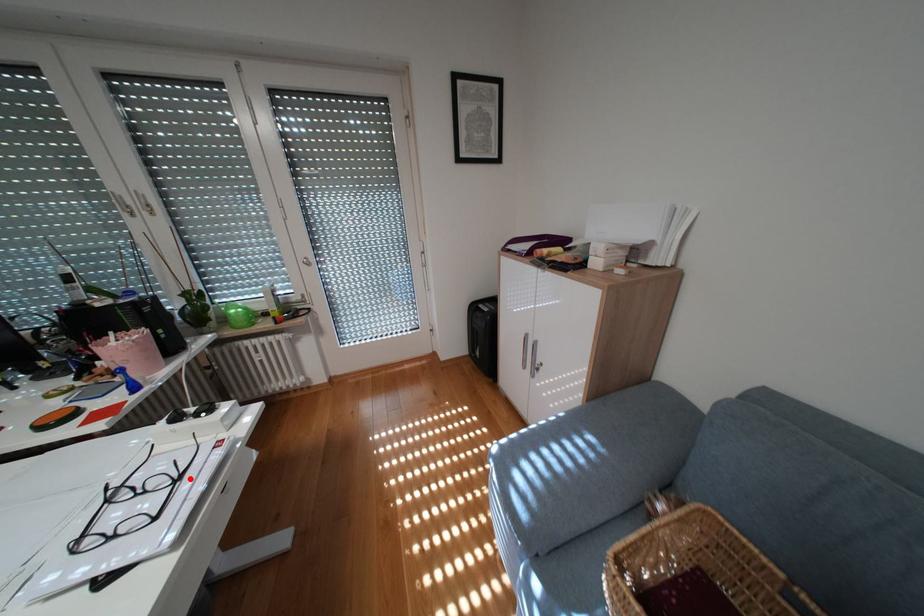
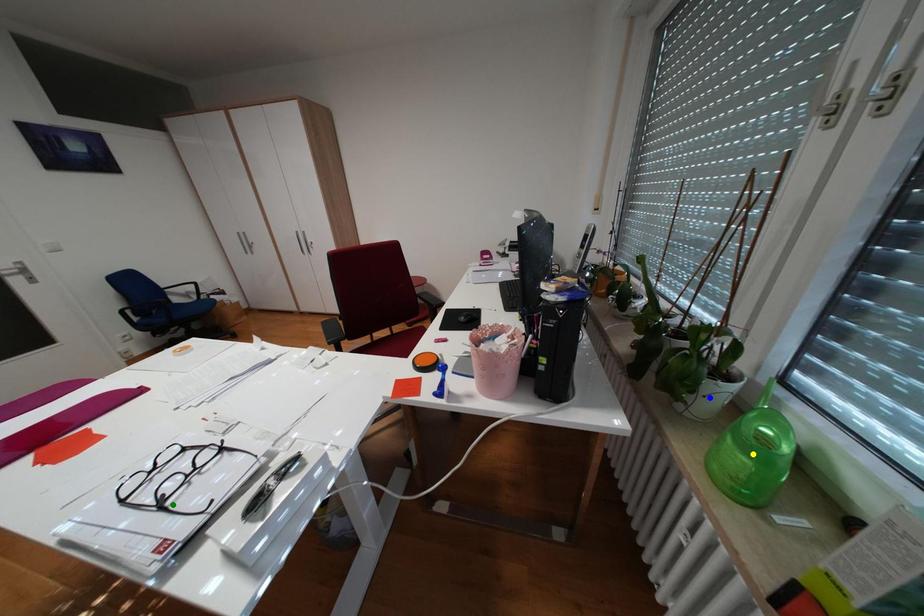
Question: I am providing you with two images of the same scene from different viewpoints. A red point is marked on the first image. You are given multiple points on the second image. Which point in image 2 is actually the same real-world point as the red point in image 1?

Choices:
 (A) blue point
 (B) yellow point
 (C) green point

Answer: (C)